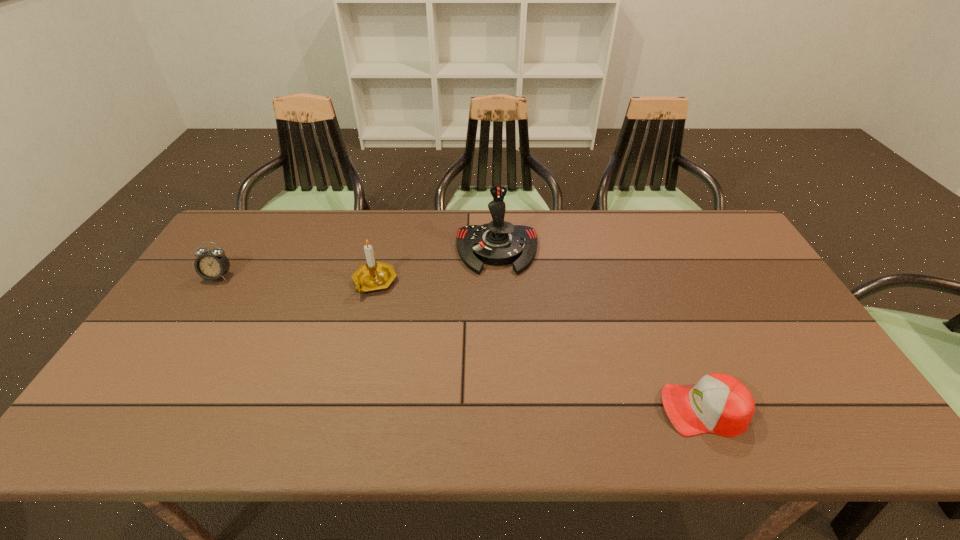
Find the location of a particular element. This screenshot has height=540, width=960. vacant space located 0.200m on the face of the leftmost object is located at coordinates (180, 336).

Locate an element on the screen. The width and height of the screenshot is (960, 540). vacant space located on the front-facing side of the shortest object is located at coordinates (588, 409).

Image resolution: width=960 pixels, height=540 pixels. I want to click on vacant area located 0.390m on the front-facing side of the shortest object, so click(492, 409).

At what (x,y) coordinates should I click in order to perform the action: click on vacant space situated 0.190m on the front-facing side of the shortest object. Please return your answer as a coordinate pair (x, y). This screenshot has height=540, width=960. Looking at the image, I should click on (580, 409).

Where is `object positioned at the far edge`? The image size is (960, 540). object positioned at the far edge is located at coordinates (499, 242).

Identify the location of object present at the near edge. Image resolution: width=960 pixels, height=540 pixels. (719, 403).

You are a GUI agent. You are given a task and a screenshot of the screen. Output one action in this format:
    pyautogui.click(x=<x>, y=<y>)
    Task: Click on the object that is at the left edge
    The image size is (960, 540).
    Given the screenshot: What is the action you would take?
    pyautogui.click(x=211, y=265)

You are a GUI agent. You are given a task and a screenshot of the screen. Output one action in this format:
    pyautogui.click(x=<x>, y=<y>)
    Task: Click on the vacant space at the far edge of the desktop
    
    Given the screenshot: What is the action you would take?
    pyautogui.click(x=358, y=242)

Find the location of `vacant area at the near edge`. vacant area at the near edge is located at coordinates (337, 415).

Where is `vacant space at the left edge of the desktop`? This screenshot has height=540, width=960. vacant space at the left edge of the desktop is located at coordinates (205, 343).